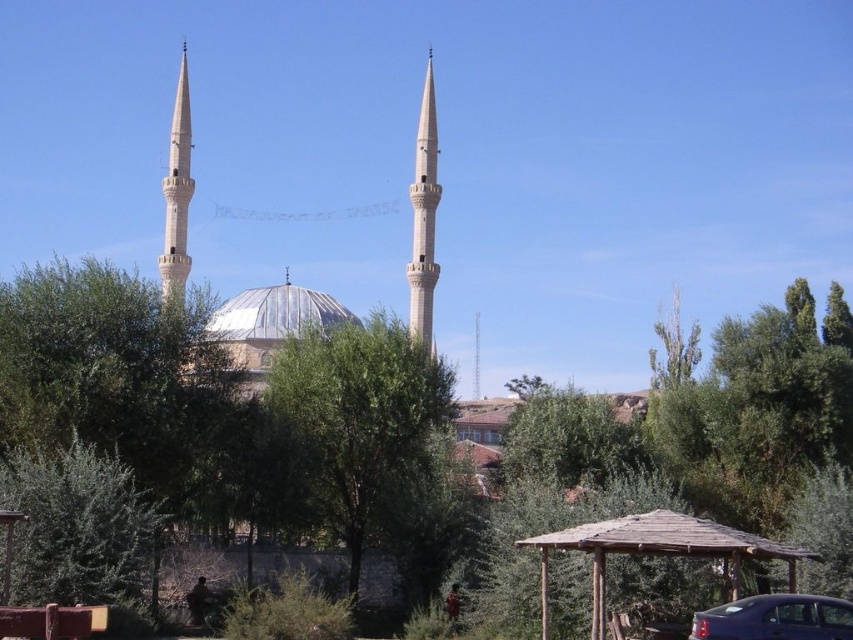
You are standing in the foreground of the scene and want to take a photo of the metallic silver dome at center without the green leafy tree at lower left blocking the view. Which direction should you move to ensure the dome is visible without the tree in the frame?

Move to the right side of the scene so that the green leafy tree at lower left is no longer blocking the view of the metallic silver dome at center.